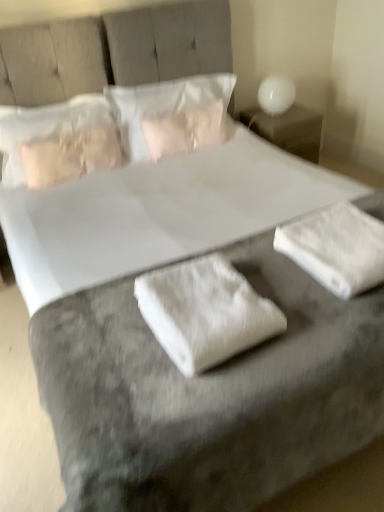
Locate an element on the screen. vacant space in between white fluffy towel at lower right, arranged as the second material when viewed from the left, and white fabric at center, the second material positioned from the right is located at coordinates (288, 289).